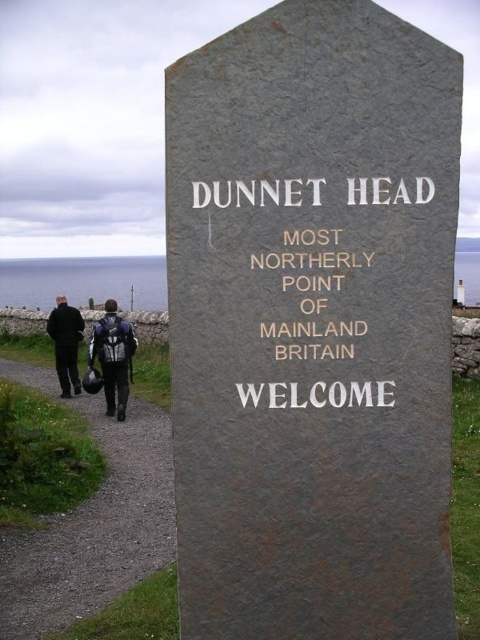
Question: Which object appears closest to the camera in this image?

Choices:
 (A) dirt/gravel path at lower left
 (B) gray stone monument at center

Answer: (B)

Question: Does dirt/gravel path at lower left appear under dark wool coat at lower left?

Choices:
 (A) yes
 (B) no

Answer: (A)

Question: Does goldmaterial/texturetext at center appear on the left side of black leather jacket at lower left?

Choices:
 (A) no
 (B) yes

Answer: (A)

Question: Which is nearer to the dirt/gravel path at lower left?

Choices:
 (A) dark wool coat at lower left
 (B) black leather jacket at lower left
 (C) goldmaterial/texturetext at center
 (D) gray stone monument at center

Answer: (B)

Question: Considering the real-world distances, which object is farthest from the dirt/gravel path at lower left?

Choices:
 (A) gray stone monument at center
 (B) dark wool coat at lower left
 (C) black leather jacket at lower left

Answer: (B)

Question: Does gray stone monument at center appear on the right side of goldmaterial/texturetext at center?

Choices:
 (A) yes
 (B) no

Answer: (A)